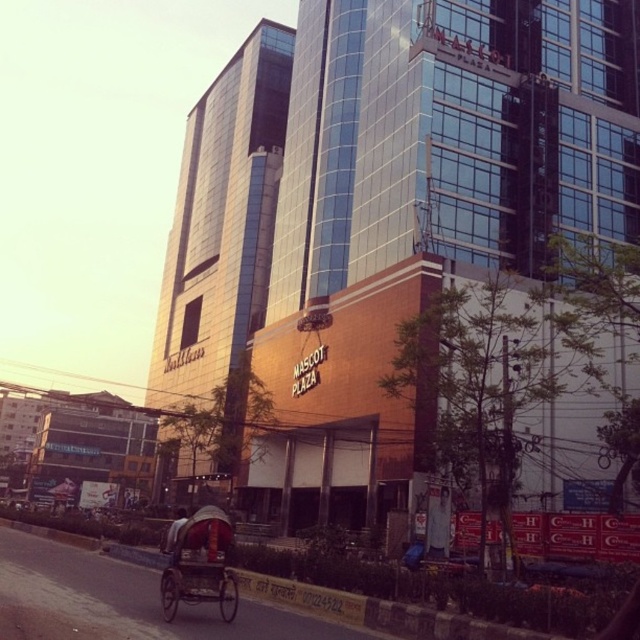
Question: Does glassy metallic building at center appear under wooden rickshaw at lower left?

Choices:
 (A) yes
 (B) no

Answer: (B)

Question: Can you confirm if glassy metallic building at center is positioned above wooden rickshaw at lower left?

Choices:
 (A) yes
 (B) no

Answer: (A)

Question: Among these objects, which one is nearest to the camera?

Choices:
 (A) glassy metallic building at center
 (B) wooden rickshaw at lower left

Answer: (B)

Question: Among these points, which one is farthest from the camera?

Choices:
 (A) (198, 589)
 (B) (208, 298)

Answer: (B)

Question: Is glassy metallic building at center positioned behind wooden rickshaw at lower left?

Choices:
 (A) no
 (B) yes

Answer: (B)